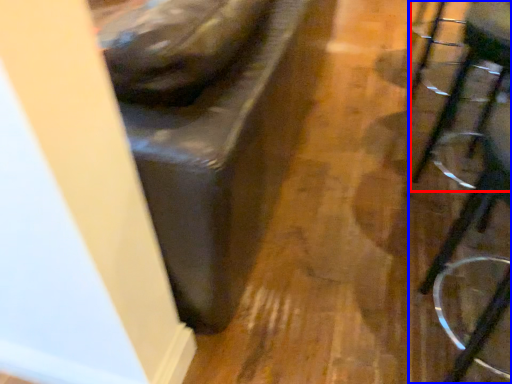
Question: Among these objects, which one is nearest to the camera, swivel chair (highlighted by a red box) or furniture (highlighted by a blue box)?

Choices:
 (A) swivel chair
 (B) furniture

Answer: (B)